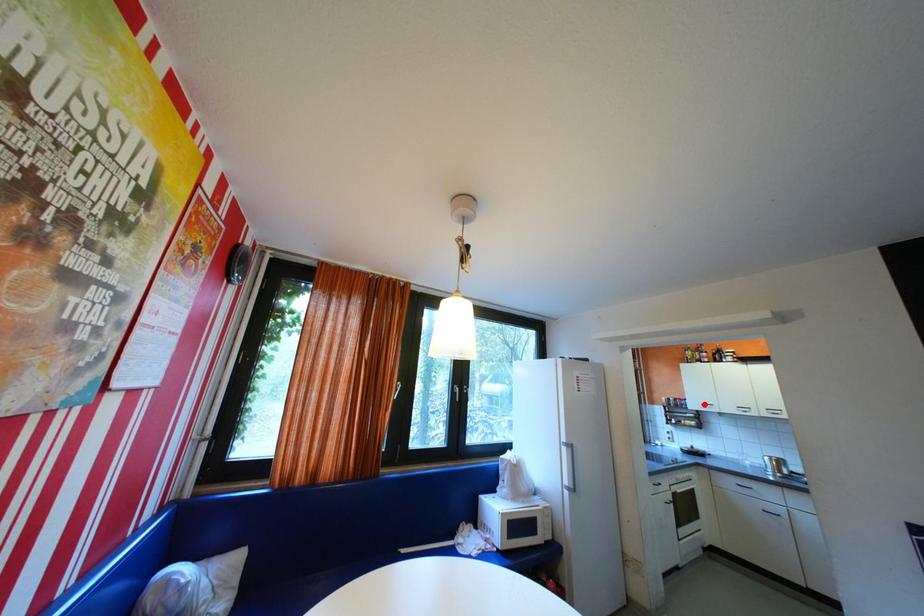
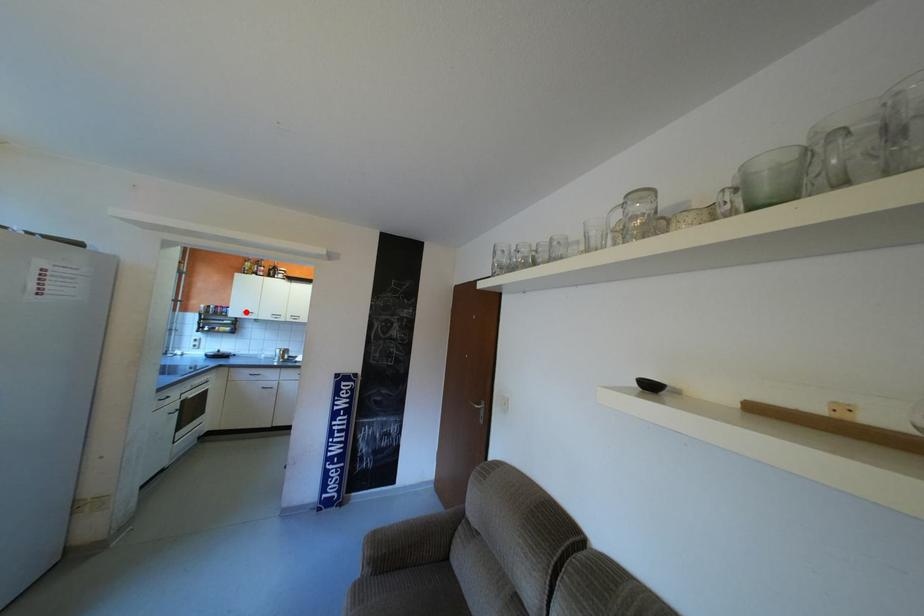
I am providing you with two images of the same scene from different viewpoints. A red point is marked on the first image and another point is marked on the second image. Are the points marked in image1 and image2 representing the same 3D position?

Yes